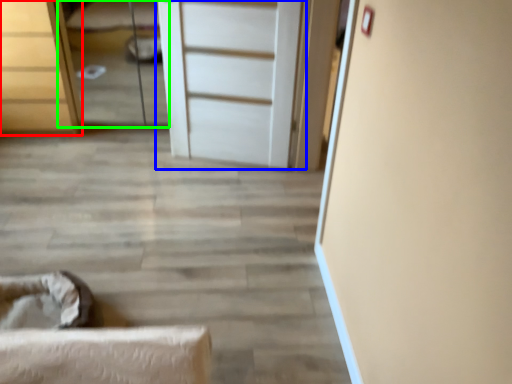
Question: Estimate the real-world distances between objects in this image. Which object is farther from chest of drawers (highlighted by a red box), door (highlighted by a blue box) or bed (highlighted by a green box)?

Choices:
 (A) door
 (B) bed

Answer: (A)